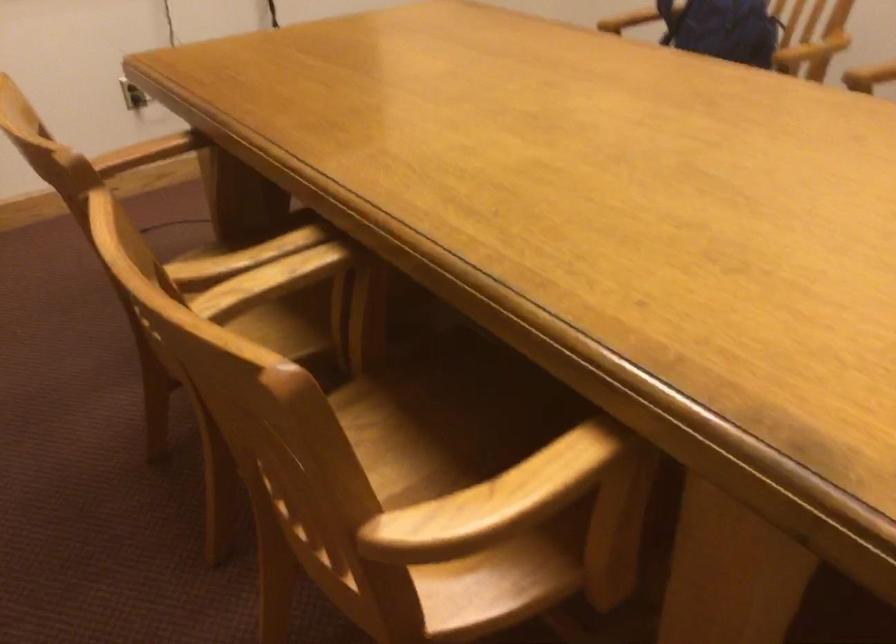
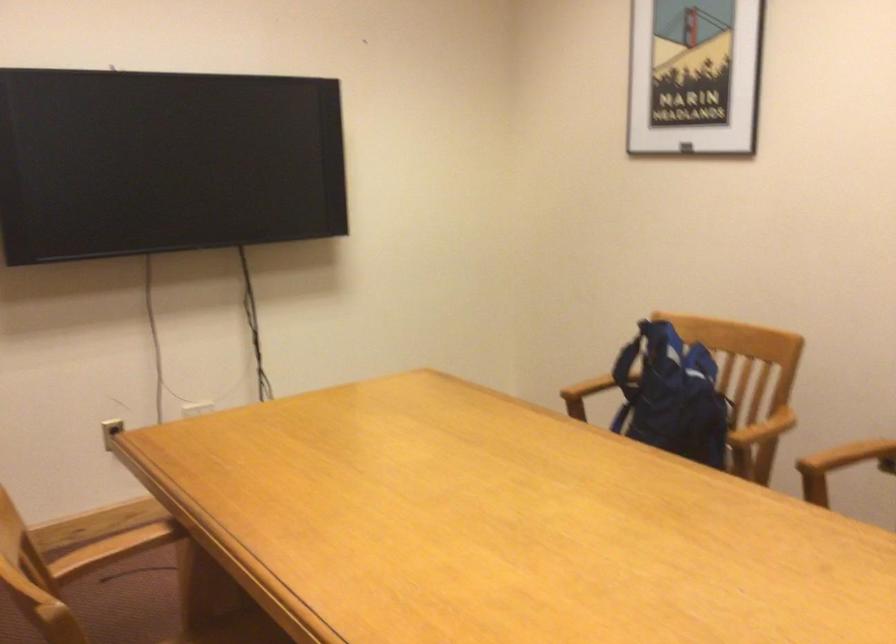
The point at (128, 185) is marked in the first image. Where is the corresponding point in the second image?

(92, 526)